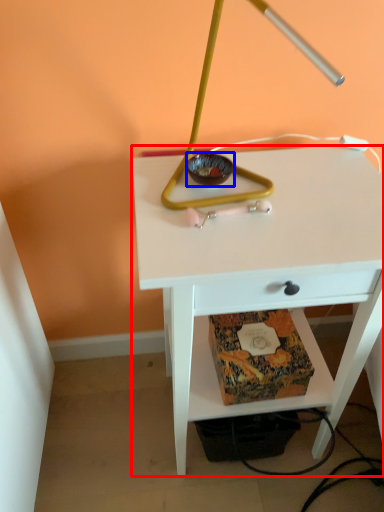
Question: Which object is closer to the camera taking this photo, table (highlighted by a red box) or glass bowl (highlighted by a blue box)?

Choices:
 (A) table
 (B) glass bowl

Answer: (A)